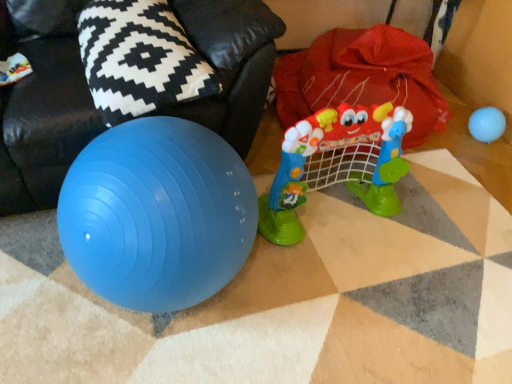
The image size is (512, 384). What do you see at coordinates (336, 164) in the screenshot?
I see `plastic toy at center, the 2th toy viewed from the right` at bounding box center [336, 164].

At what (x,y) coordinates should I click in order to perform the action: click on plastic toy at center, the first toy from the front. Please return your answer as a coordinate pair (x, y). Image resolution: width=512 pixels, height=384 pixels. Looking at the image, I should click on (336, 164).

Where is `red fabric bean bag at upper right`? Image resolution: width=512 pixels, height=384 pixels. red fabric bean bag at upper right is located at coordinates (42, 106).

Can you confirm if black and white patterned pillow at upper left is smaller than plastic toy at center, the first toy from the front?

Yes, black and white patterned pillow at upper left is smaller than plastic toy at center, the first toy from the front.

Consider the image. Is black and white patterned pillow at upper left positioned with its back to plastic toy at center, which is the first toy from left to right?

No.

From a real-world perspective, is black and white patterned pillow at upper left positioned over plastic toy at center, which is the first toy from left to right, based on gravity?

Yes, from a real-world perspective, black and white patterned pillow at upper left is on top of plastic toy at center, which is the first toy from left to right.

From a real-world perspective, starting from the black and white patterned pillow at upper left, which toy is the 1st one below it? Please provide its 2D coordinates.

[(336, 164)]

From the image's perspective, is plastic toy at center, the first toy from the front, positioned above or below black and white patterned pillow at upper left?

Clearly, from the image's perspective, plastic toy at center, the first toy from the front, is below black and white patterned pillow at upper left.

Between point (294, 146) and point (91, 75), which one is positioned behind?

Point (294, 146)

Is plastic toy at center, arranged as the second toy when viewed from the back, far from black and white patterned pillow at upper left?

plastic toy at center, arranged as the second toy when viewed from the back, is near black and white patterned pillow at upper left, not far away.

Could black and white patterned pillow at upper left be considered to be inside blue rubber ball at upper right, positioned as the 1th toy in right-to-left order?

No, black and white patterned pillow at upper left is not surrounded by blue rubber ball at upper right, positioned as the 1th toy in right-to-left order.

Considering the points (497, 129) and (95, 21), which point is behind, point (497, 129) or point (95, 21)?

The point (497, 129) is farther.

Considering the positions of objects blue rubber ball at upper right, which appears as the 2th toy when viewed from the front, and black and white patterned pillow at upper left in the image provided, who is more to the right, blue rubber ball at upper right, which appears as the 2th toy when viewed from the front, or black and white patterned pillow at upper left?

From the viewer's perspective, blue rubber ball at upper right, which appears as the 2th toy when viewed from the front, appears more on the right side.

Consider the image. From the image's perspective, is red fabric bean bag at upper right located above or below plastic toy at center, the first toy from the front?

Based on their image positions, red fabric bean bag at upper right is located above plastic toy at center, the first toy from the front.

Is red fabric bean bag at upper right far from plastic toy at center, the first toy from the front?

No, red fabric bean bag at upper right is in close proximity to plastic toy at center, the first toy from the front.

In terms of size, does red fabric bean bag at upper right appear bigger or smaller than plastic toy at center, the 2th toy viewed from the right?

In the image, red fabric bean bag at upper right appears to be larger than plastic toy at center, the 2th toy viewed from the right.

Which object is more forward, red fabric bean bag at upper right or plastic toy at center, arranged as the second toy when viewed from the back?

Positioned in front is red fabric bean bag at upper right.

Between plastic toy at center, the 2th toy viewed from the right, and blue rubber ball at upper right, which appears as the 2th toy when viewed from the front, which one has more height?

Standing taller between the two is plastic toy at center, the 2th toy viewed from the right.

Which is closer to the camera, (284, 153) or (493, 115)?

Positioned in front is point (284, 153).

From the image's perspective, who appears lower, plastic toy at center, arranged as the second toy when viewed from the back, or blue rubber ball at upper right, positioned as the second toy in left-to-right order?

plastic toy at center, arranged as the second toy when viewed from the back, from the image's perspective.

Which of these two, plastic toy at center, arranged as the second toy when viewed from the back, or blue rubber ball at upper right, positioned as the 1th toy in right-to-left order, is thinner?

blue rubber ball at upper right, positioned as the 1th toy in right-to-left order, is thinner.

How many degrees apart are the facing directions of black and white patterned pillow at upper left and blue rubber ball at upper right, which appears as the 2th toy when viewed from the front?

The angular difference between black and white patterned pillow at upper left and blue rubber ball at upper right, which appears as the 2th toy when viewed from the front, is 5.59 degrees.

Is black and white patterned pillow at upper left completely or partially outside of blue rubber ball at upper right, which appears as the 2th toy when viewed from the front?

Absolutely, black and white patterned pillow at upper left is external to blue rubber ball at upper right, which appears as the 2th toy when viewed from the front.

Could you tell me if black and white patterned pillow at upper left is turned towards blue rubber ball at upper right, positioned as the second toy in left-to-right order?

No, black and white patterned pillow at upper left is not facing towards blue rubber ball at upper right, positioned as the second toy in left-to-right order.

Do you think red fabric bean bag at upper right is within blue rubber ball at upper right, positioned as the second toy in left-to-right order, or outside of it?

red fabric bean bag at upper right is outside blue rubber ball at upper right, positioned as the second toy in left-to-right order.

Which is behind, point (234, 111) or point (500, 111)?

The point (500, 111) is behind.

Where is `the 2nd toy counting from the right side of the red fabric bean bag at upper right`? the 2nd toy counting from the right side of the red fabric bean bag at upper right is located at coordinates (487, 124).

Considering their positions, is red fabric bean bag at upper right located in front of or behind blue rubber ball at upper right, positioned as the 1th toy in right-to-left order?

red fabric bean bag at upper right is positioned closer to the viewer than blue rubber ball at upper right, positioned as the 1th toy in right-to-left order.

Identify the location of pillow located above the plastic toy at center, arranged as the second toy when viewed from the back (from a real-world perspective). (139, 59).

Identify the location of the 2nd toy below the black and white patterned pillow at upper left (from the image's perspective). (336, 164).

Considering their positions, is blue rubber ball at upper right, positioned as the 1th toy in right-to-left order, positioned closer to red fabric bean bag at upper right than black and white patterned pillow at upper left?

Among the two, black and white patterned pillow at upper left is located nearer to red fabric bean bag at upper right.

From the image, which object appears to be nearer to red fabric bean bag at upper right, black and white patterned pillow at upper left or plastic toy at center, arranged as the second toy when viewed from the back?

black and white patterned pillow at upper left is closer to red fabric bean bag at upper right.

Based on their spatial positions, is black and white patterned pillow at upper left or plastic toy at center, which is the first toy from left to right, further from blue rubber ball at upper right, which appears as the 2th toy when viewed from the front?

Among the two, black and white patterned pillow at upper left is located further to blue rubber ball at upper right, which appears as the 2th toy when viewed from the front.

Looking at the image, which one is located closer to red fabric bean bag at upper right, plastic toy at center, arranged as the second toy when viewed from the back, or blue rubber ball at upper right, positioned as the 1th toy in right-to-left order?

plastic toy at center, arranged as the second toy when viewed from the back, lies closer to red fabric bean bag at upper right than the other object.

Estimate the real-world distances between objects in this image. Which object is closer to blue rubber ball at upper right, positioned as the 1th toy in right-to-left order, plastic toy at center, the 2th toy viewed from the right, or red fabric bean bag at upper right?

plastic toy at center, the 2th toy viewed from the right, lies closer to blue rubber ball at upper right, positioned as the 1th toy in right-to-left order, than the other object.

Looking at the image, which one is located further to plastic toy at center, the first toy from the front, blue rubber ball at upper right, positioned as the second toy in left-to-right order, or red fabric bean bag at upper right?

blue rubber ball at upper right, positioned as the second toy in left-to-right order, lies further to plastic toy at center, the first toy from the front, than the other object.

Based on their spatial positions, is red fabric bean bag at upper right or black and white patterned pillow at upper left further from plastic toy at center, the 2th toy viewed from the right?

Among the two, black and white patterned pillow at upper left is located further to plastic toy at center, the 2th toy viewed from the right.

Based on their spatial positions, is plastic toy at center, which is the first toy from left to right, or black and white patterned pillow at upper left further from red fabric bean bag at upper right?

plastic toy at center, which is the first toy from left to right, is further to red fabric bean bag at upper right.

You are a GUI agent. You are given a task and a screenshot of the screen. Output one action in this format:
    pyautogui.click(x=<x>, y=<y>)
    Task: Click on the pillow between red fabric bean bag at upper right and blue rubber ball at upper right, positioned as the second toy in left-to-right order, in the horizontal direction
    The height and width of the screenshot is (384, 512).
    Given the screenshot: What is the action you would take?
    pyautogui.click(x=139, y=59)

This screenshot has width=512, height=384. I want to click on toy between black and white patterned pillow at upper left and blue rubber ball at upper right, the first toy positioned from the back, from left to right, so click(336, 164).

The image size is (512, 384). I want to click on toy between red fabric bean bag at upper right and blue rubber ball at upper right, positioned as the second toy in left-to-right order, in the horizontal direction, so click(336, 164).

Find the location of a particular element. pillow located between red fabric bean bag at upper right and plastic toy at center, the 2th toy viewed from the right, in the left-right direction is located at coordinates (139, 59).